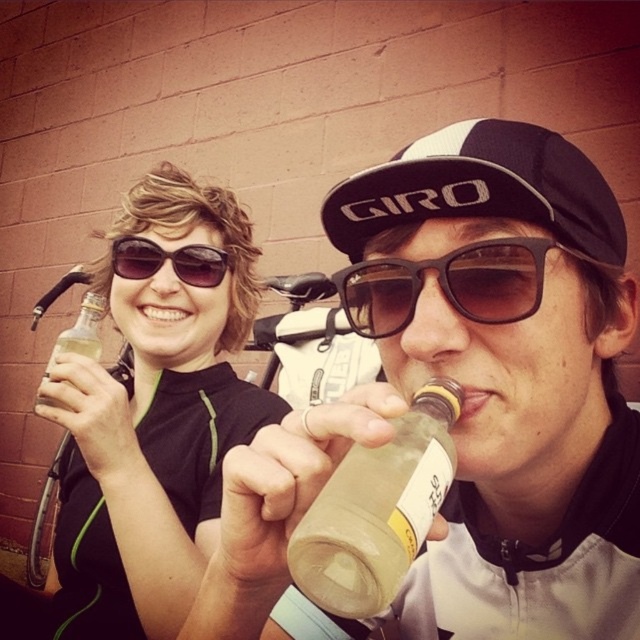
Question: Estimate the real-world distances between objects in this image. Which object is closer to the black mesh cap at center?

Choices:
 (A) brown matte sunglasses at center
 (B) translucent glass bottle at center

Answer: (A)

Question: Which of the following is the closest to the observer?

Choices:
 (A) (349, 317)
 (B) (392, 560)
 (C) (173, 305)
 (D) (193, 256)

Answer: (B)

Question: Is black mesh cap at center thinner than translucent glass bottle at upper left?

Choices:
 (A) no
 (B) yes

Answer: (A)

Question: Can you confirm if translucent plastic bottle at center is wider than matte black sunglasses at upper left?

Choices:
 (A) no
 (B) yes

Answer: (A)

Question: Does black mesh cap at center appear over translucent glass bottle at upper left?

Choices:
 (A) yes
 (B) no

Answer: (A)

Question: Which of the following is the closest to the observer?

Choices:
 (A) brown matte sunglasses at center
 (B) matte black sunglasses at upper left
 (C) translucent glass bottle at center

Answer: (C)